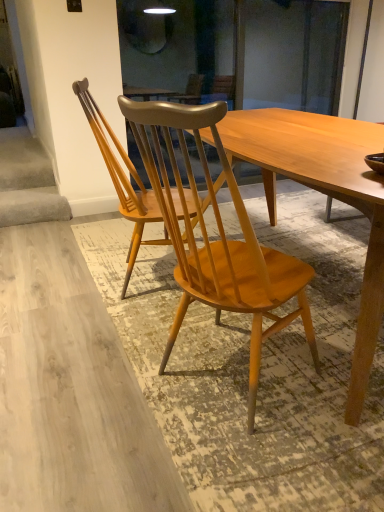
Question: Looking at their shapes, would you say natural wood chair at center, arranged as the second chair when viewed from the back, is wider or thinner than light brown wood chair at center, positioned as the 1th chair in back-to-front order?

Choices:
 (A) wide
 (B) thin

Answer: (B)

Question: Is natural wood chair at center, acting as the first chair starting from the front, inside or outside of light brown wood chair at center, arranged as the second chair when viewed from the front?

Choices:
 (A) outside
 (B) inside

Answer: (A)

Question: Does point (142, 155) appear closer or farther from the camera than point (94, 117)?

Choices:
 (A) closer
 (B) farther

Answer: (A)

Question: Looking at their shapes, would you say light brown wood chair at center, arranged as the second chair when viewed from the front, is wider or thinner than natural wood chair at center, arranged as the second chair when viewed from the back?

Choices:
 (A) thin
 (B) wide

Answer: (B)

Question: In the image, is light brown wood chair at center, positioned as the 1th chair in back-to-front order, positioned in front of or behind natural wood chair at center, arranged as the second chair when viewed from the back?

Choices:
 (A) behind
 (B) front

Answer: (A)

Question: Which is correct: light brown wood chair at center, positioned as the 1th chair in back-to-front order, is inside natural wood chair at center, arranged as the second chair when viewed from the back, or outside of it?

Choices:
 (A) outside
 (B) inside

Answer: (A)

Question: Considering the positions of point (134, 210) and point (240, 302), is point (134, 210) closer or farther from the camera than point (240, 302)?

Choices:
 (A) farther
 (B) closer

Answer: (A)